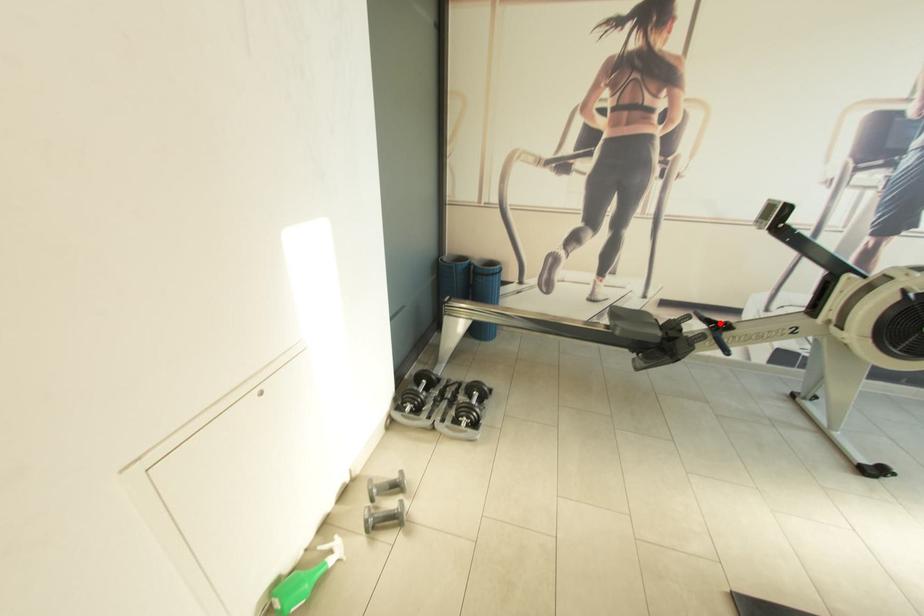
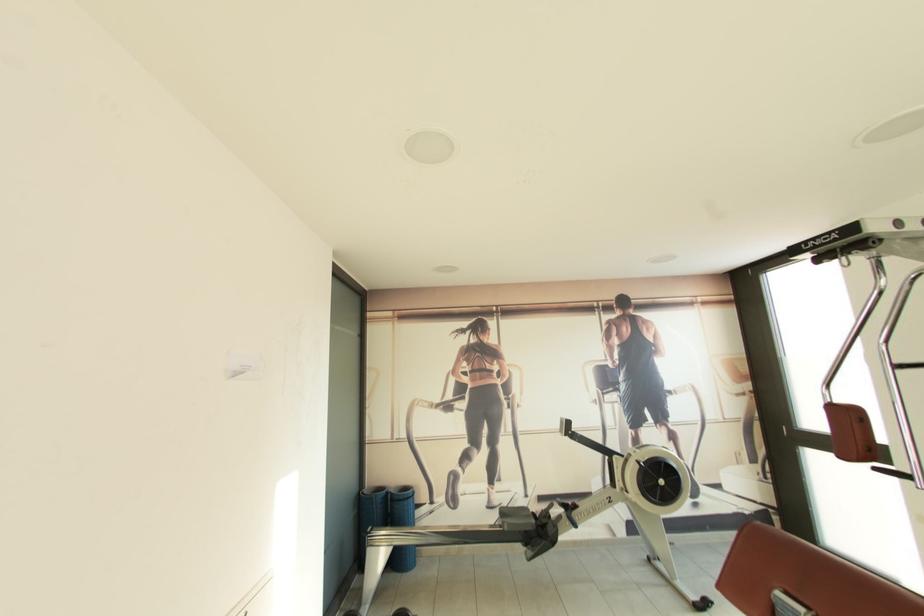
Locate, in the second image, the point that corresponds to the highlighted location in the first image.

(573, 507)